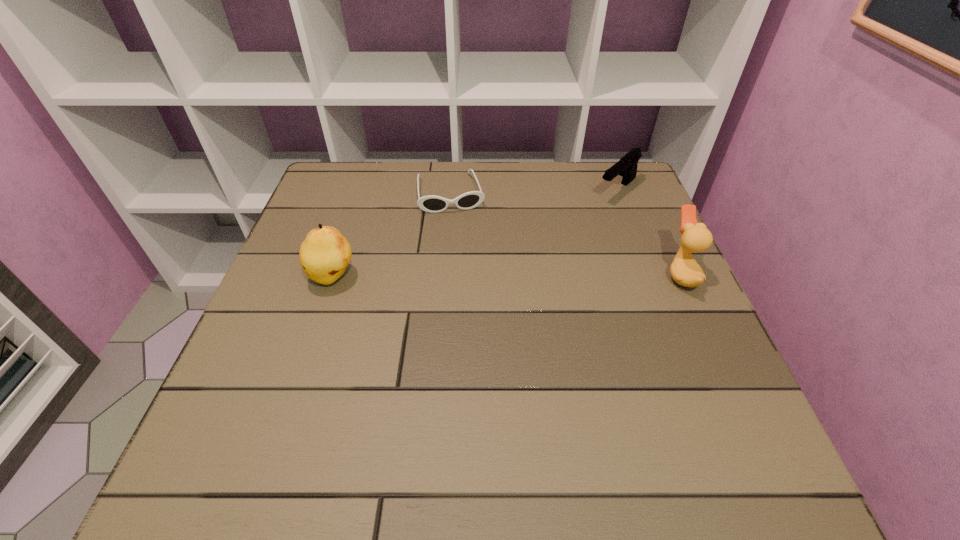
Find the location of a particular element. This screenshot has width=960, height=540. object positioned at the far right corner is located at coordinates (626, 167).

The image size is (960, 540). In the image, there is a desktop. What are the coordinates of `vacant space at the far edge` in the screenshot? It's located at (405, 200).

Where is `vacant space at the near edge of the desktop`? vacant space at the near edge of the desktop is located at coordinates (492, 406).

Where is `free spot at the right edge of the desktop`? Image resolution: width=960 pixels, height=540 pixels. free spot at the right edge of the desktop is located at coordinates (596, 228).

This screenshot has height=540, width=960. In order to click on blank space at the far left corner in this screenshot , I will do `click(378, 172)`.

Find the location of `vacant space at the near left corner of the desktop`. vacant space at the near left corner of the desktop is located at coordinates (284, 407).

At what (x,y) coordinates should I click in order to perform the action: click on vacant region at the far right corner of the desktop. Please return your answer as a coordinate pair (x, y). The width and height of the screenshot is (960, 540). Looking at the image, I should click on (579, 173).

Image resolution: width=960 pixels, height=540 pixels. I want to click on free space at the near right corner, so click(x=697, y=410).

The height and width of the screenshot is (540, 960). I want to click on free spot between the leftmost object and the shortest object, so click(x=392, y=235).

At what (x,y) coordinates should I click in order to perform the action: click on vacant area that lies between the second object from left to right and the duck. Please return your answer as a coordinate pair (x, y). Looking at the image, I should click on (565, 234).